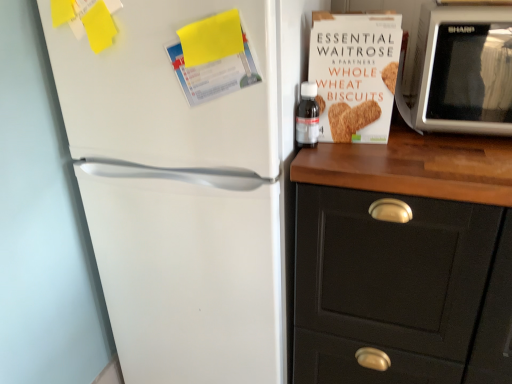
In the scene shown: In order to face white cardboard box of whole wheat biscuits at upper right, should I rotate leftwards or rightwards?

You should rotate right by 12.680 degrees.

What do you see at coordinates (404, 260) in the screenshot?
I see `black matte cabinet at right` at bounding box center [404, 260].

This screenshot has width=512, height=384. Describe the element at coordinates (461, 71) in the screenshot. I see `white plastic microwave at upper right` at that location.

Where is `white cardboard box of whole wheat biscuits at upper right`? white cardboard box of whole wheat biscuits at upper right is located at coordinates (355, 74).

Is transparent plastic bottle at upper right at the right side of white plastic microwave at upper right?

Incorrect, transparent plastic bottle at upper right is not on the right side of white plastic microwave at upper right.

Does transparent plastic bottle at upper right have a smaller size compared to white plastic microwave at upper right?

Correct, transparent plastic bottle at upper right occupies less space than white plastic microwave at upper right.

From their relative heights in the image, would you say transparent plastic bottle at upper right is taller or shorter than white plastic microwave at upper right?

transparent plastic bottle at upper right is shorter than white plastic microwave at upper right.

Is transparent plastic bottle at upper right facing away from white plastic microwave at upper right?

No, transparent plastic bottle at upper right's orientation is not away from white plastic microwave at upper right.

Can you confirm if black matte cabinet at right is taller than white plastic microwave at upper right?

Correct, black matte cabinet at right is much taller as white plastic microwave at upper right.

The height and width of the screenshot is (384, 512). I want to click on microwave oven behind the black matte cabinet at right, so click(x=461, y=71).

Which point is more distant from viewer, (382, 266) or (425, 29)?

The point (425, 29) is behind.

Is point (254, 109) positioned after point (438, 66)?

That is False.

Is white matte refrigerator at left at the right side of white plastic microwave at upper right?

Incorrect, white matte refrigerator at left is not on the right side of white plastic microwave at upper right.

Locate an element on the screen. This screenshot has height=384, width=512. refrigerator below the white plastic microwave at upper right (from a real-world perspective) is located at coordinates (189, 190).

Is white matte refrigerator at left directly adjacent to white plastic microwave at upper right?

white matte refrigerator at left and white plastic microwave at upper right are clearly separated.

Is the position of white cardboard box of whole wheat biscuits at upper right less distant than that of white matte refrigerator at left?

No, it is behind white matte refrigerator at left.

Which of these two, white cardboard box of whole wheat biscuits at upper right or white matte refrigerator at left, is wider?

white matte refrigerator at left is wider.

Considering the positions of points (373, 129) and (230, 364), is point (373, 129) farther from camera compared to point (230, 364)?

That is False.

Is there a large distance between white cardboard box of whole wheat biscuits at upper right and white matte refrigerator at left?

No, white cardboard box of whole wheat biscuits at upper right is in close proximity to white matte refrigerator at left.

Which object is positioned more to the left, white cardboard box of whole wheat biscuits at upper right or white plastic microwave at upper right?

From the viewer's perspective, white cardboard box of whole wheat biscuits at upper right appears more on the left side.

Is there a large distance between white cardboard box of whole wheat biscuits at upper right and white plastic microwave at upper right?

Actually, white cardboard box of whole wheat biscuits at upper right and white plastic microwave at upper right are a little close together.

Considering the points (400, 31) and (436, 94), which point is in front, point (400, 31) or point (436, 94)?

The point (400, 31) is closer to the camera.

This screenshot has height=384, width=512. I want to click on paperback book that is under the white plastic microwave at upper right (from a real-world perspective), so click(355, 74).

Between transparent plastic bottle at upper right and white cardboard box of whole wheat biscuits at upper right, which one appears on the right side from the viewer's perspective?

From the viewer's perspective, white cardboard box of whole wheat biscuits at upper right appears more on the right side.

From a real-world perspective, is transparent plastic bottle at upper right physically located above or below white cardboard box of whole wheat biscuits at upper right?

In terms of real-world spatial position, transparent plastic bottle at upper right is below white cardboard box of whole wheat biscuits at upper right.

Is transparent plastic bottle at upper right outside of white cardboard box of whole wheat biscuits at upper right?

Indeed, transparent plastic bottle at upper right is completely outside white cardboard box of whole wheat biscuits at upper right.

In order to click on paperback book in front of the transparent plastic bottle at upper right in this screenshot , I will do `click(355, 74)`.

Do you think white plastic microwave at upper right is within white matte refrigerator at left, or outside of it?

white plastic microwave at upper right is located beyond the bounds of white matte refrigerator at left.

Considering the sizes of objects white plastic microwave at upper right and white matte refrigerator at left in the image provided, who is taller, white plastic microwave at upper right or white matte refrigerator at left?

Standing taller between the two is white matte refrigerator at left.

Is white plastic microwave at upper right beside white matte refrigerator at left?

white plastic microwave at upper right and white matte refrigerator at left are clearly separated.

From a real-world perspective, is white plastic microwave at upper right on top of white matte refrigerator at left?

Yes, from a real-world perspective, white plastic microwave at upper right is on top of white matte refrigerator at left.

In the image, there is a transparent plastic bottle at upper right. At what (x,y) coordinates should I click in order to perform the action: click on microwave oven above it (from the image's perspective). Please return your answer as a coordinate pair (x, y). The image size is (512, 384). Looking at the image, I should click on (461, 71).

Where is `microwave oven above the black matte cabinet at right (from a real-world perspective)`? Image resolution: width=512 pixels, height=384 pixels. microwave oven above the black matte cabinet at right (from a real-world perspective) is located at coordinates (461, 71).

Which object lies further to the anchor point white matte refrigerator at left, white plastic microwave at upper right or white cardboard box of whole wheat biscuits at upper right?

The object further to white matte refrigerator at left is white plastic microwave at upper right.

Looking at the image, which one is located closer to transparent plastic bottle at upper right, white matte refrigerator at left or white plastic microwave at upper right?

white plastic microwave at upper right is positioned closer to the anchor transparent plastic bottle at upper right.

Which object lies nearer to the anchor point transparent plastic bottle at upper right, white matte refrigerator at left or black matte cabinet at right?

black matte cabinet at right lies closer to transparent plastic bottle at upper right than the other object.

From the image, which object appears to be farther from white cardboard box of whole wheat biscuits at upper right, transparent plastic bottle at upper right or black matte cabinet at right?

The object further to white cardboard box of whole wheat biscuits at upper right is black matte cabinet at right.

From the image, which object appears to be farther from white cardboard box of whole wheat biscuits at upper right, white plastic microwave at upper right or black matte cabinet at right?

black matte cabinet at right lies further to white cardboard box of whole wheat biscuits at upper right than the other object.

Based on their spatial positions, is white cardboard box of whole wheat biscuits at upper right or white plastic microwave at upper right further from white matte refrigerator at left?

white plastic microwave at upper right.

When comparing their distances from white matte refrigerator at left, does black matte cabinet at right or white plastic microwave at upper right seem further?

white plastic microwave at upper right is further to white matte refrigerator at left.

Estimate the real-world distances between objects in this image. Which object is further from black matte cabinet at right, transparent plastic bottle at upper right or white cardboard box of whole wheat biscuits at upper right?

Among the two, transparent plastic bottle at upper right is located further to black matte cabinet at right.

Where is `paperback book between white plastic microwave at upper right and black matte cabinet at right in the up-down direction`? The height and width of the screenshot is (384, 512). paperback book between white plastic microwave at upper right and black matte cabinet at right in the up-down direction is located at coordinates (355, 74).

Image resolution: width=512 pixels, height=384 pixels. Find the location of `bottle between white matte refrigerator at left and white cardboard box of whole wheat biscuits at upper right from left to right`. bottle between white matte refrigerator at left and white cardboard box of whole wheat biscuits at upper right from left to right is located at coordinates (307, 116).

In order to click on bottle between white matte refrigerator at left and black matte cabinet at right from left to right in this screenshot , I will do `click(307, 116)`.

You are a GUI agent. You are given a task and a screenshot of the screen. Output one action in this format:
    pyautogui.click(x=<x>, y=<y>)
    Task: Click on the paperback book situated between transparent plastic bottle at upper right and white plastic microwave at upper right from left to right
    
    Given the screenshot: What is the action you would take?
    pyautogui.click(x=355, y=74)